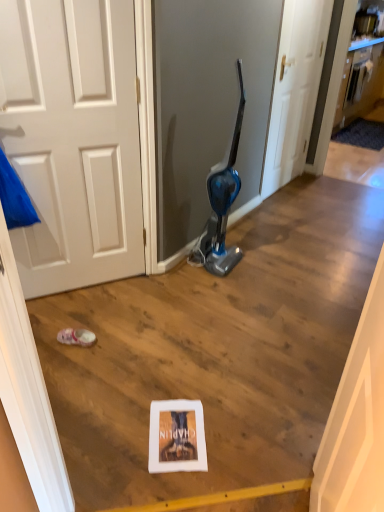
Question: Can you confirm if pink fabric shoe at lower left is shorter than wooden cabinet at upper right?

Choices:
 (A) no
 (B) yes

Answer: (B)

Question: Can you confirm if pink fabric shoe at lower left is bigger than wooden cabinet at upper right?

Choices:
 (A) yes
 (B) no

Answer: (B)

Question: From the image's perspective, is pink fabric shoe at lower left on top of wooden cabinet at upper right?

Choices:
 (A) yes
 (B) no

Answer: (B)

Question: Can you confirm if pink fabric shoe at lower left is smaller than wooden cabinet at upper right?

Choices:
 (A) yes
 (B) no

Answer: (A)

Question: Is pink fabric shoe at lower left taller than wooden cabinet at upper right?

Choices:
 (A) no
 (B) yes

Answer: (A)

Question: Is pink fabric shoe at lower left wider than wooden cabinet at upper right?

Choices:
 (A) yes
 (B) no

Answer: (A)

Question: Is pink fabric shoe at lower left bigger than white matte door at center?

Choices:
 (A) yes
 (B) no

Answer: (B)

Question: Can you confirm if pink fabric shoe at lower left is taller than white matte door at center?

Choices:
 (A) no
 (B) yes

Answer: (A)

Question: Is pink fabric shoe at lower left behind white matte door at center?

Choices:
 (A) no
 (B) yes

Answer: (A)

Question: Considering the relative sizes of pink fabric shoe at lower left and white matte door at center in the image provided, is pink fabric shoe at lower left thinner than white matte door at center?

Choices:
 (A) no
 (B) yes

Answer: (A)

Question: Does pink fabric shoe at lower left have a lesser height compared to white matte door at center?

Choices:
 (A) no
 (B) yes

Answer: (B)

Question: Is pink fabric shoe at lower left oriented towards white matte door at center?

Choices:
 (A) yes
 (B) no

Answer: (B)

Question: Does white matte door at center have a smaller size compared to wooden cabinet at upper right?

Choices:
 (A) yes
 (B) no

Answer: (B)